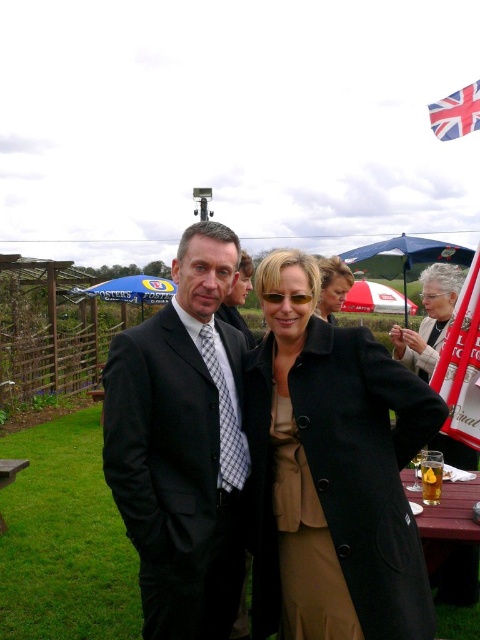
You are a photographer at the event and need to adjust the camera focus. The black wool coat at center and the matte black suit at center are both in the frame. Which object is shorter in height?

The black wool coat at center has a lesser height compared to the matte black suit at center, so the black wool coat at center is shorter.

You are a photographer at the garden party and want to ensure the black wool coat at center is visible in the photo without being blocked by the union jack fabric at upper right. Based on their positions, is this possible?

Yes, the black wool coat at center is in front of the union jack fabric at upper right, so it will be visible and not blocked by the fabric.